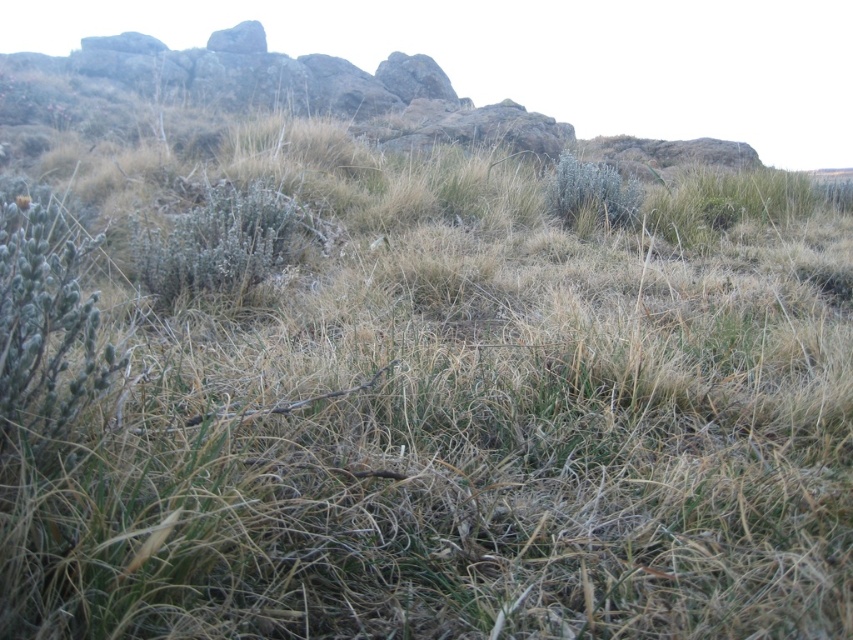
Is fuzzy gray bush at center closer to the viewer compared to silvery-green shrub at upper right?

Yes, it is.

Find the location of `fuzzy gray bush at center`. fuzzy gray bush at center is located at coordinates (223, 241).